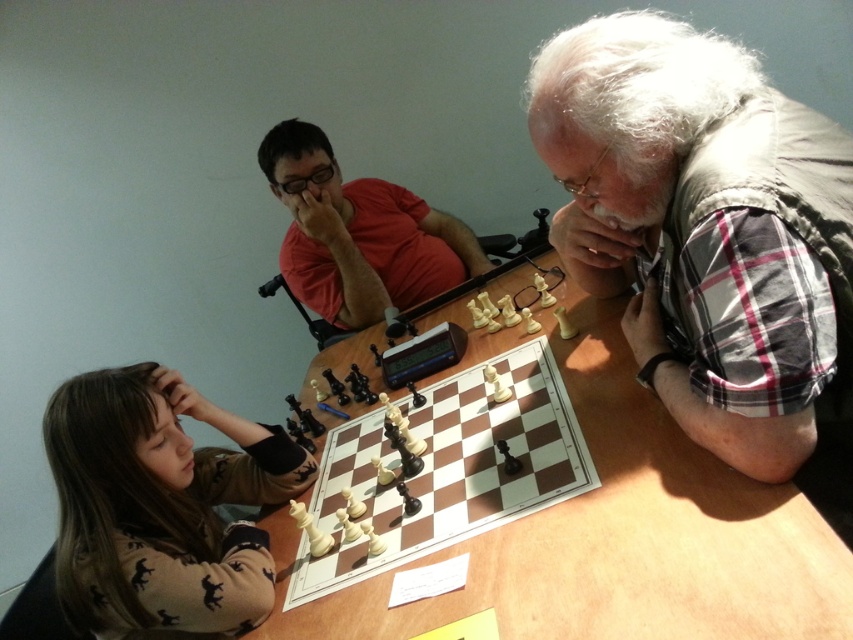
Does gray vest at upper right appear over wooden table at center?

Indeed, gray vest at upper right is positioned over wooden table at center.

Between point (647, 384) and point (618, 307), which one is positioned behind?

The point (618, 307) is more distant.

Between point (688, 45) and point (433, 624), which one is positioned in front?

Point (433, 624) is in front.

Locate an element on the screen. The height and width of the screenshot is (640, 853). gray vest at upper right is located at coordinates (699, 225).

Who is lower down, gray vest at upper right or brown sweater at lower left?

Positioned lower is brown sweater at lower left.

Does gray vest at upper right lie behind brown sweater at lower left?

That is False.

Is point (764, 378) more distant than point (78, 460)?

No, (764, 378) is closer to viewer.

I want to click on gray vest at upper right, so [699, 225].

Does gray vest at upper right appear over wooden chessboard at center?

Correct, gray vest at upper right is located above wooden chessboard at center.

Image resolution: width=853 pixels, height=640 pixels. I want to click on gray vest at upper right, so tap(699, 225).

Who is more forward, (682, 173) or (492, 403)?

Point (682, 173) is in front.

Image resolution: width=853 pixels, height=640 pixels. Identify the location of gray vest at upper right. (699, 225).